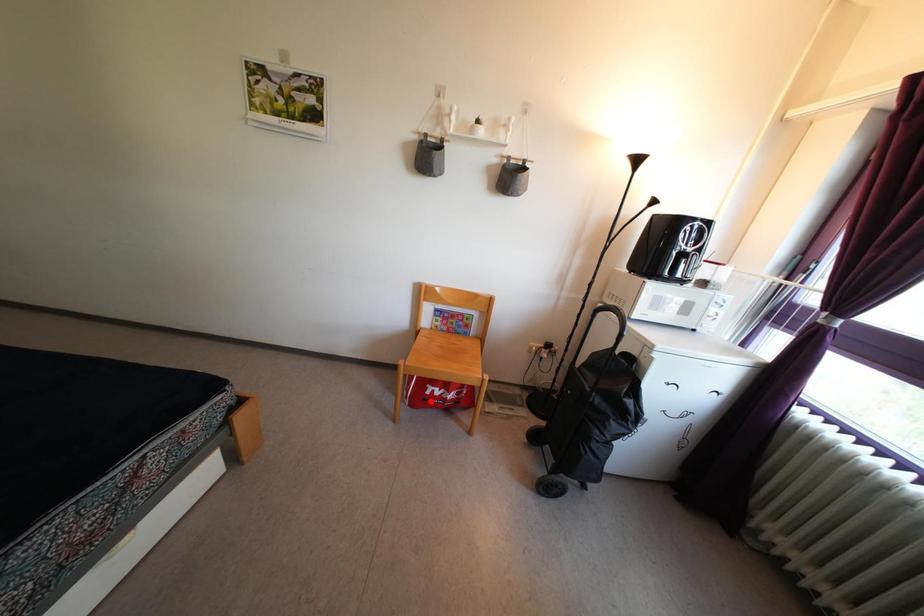
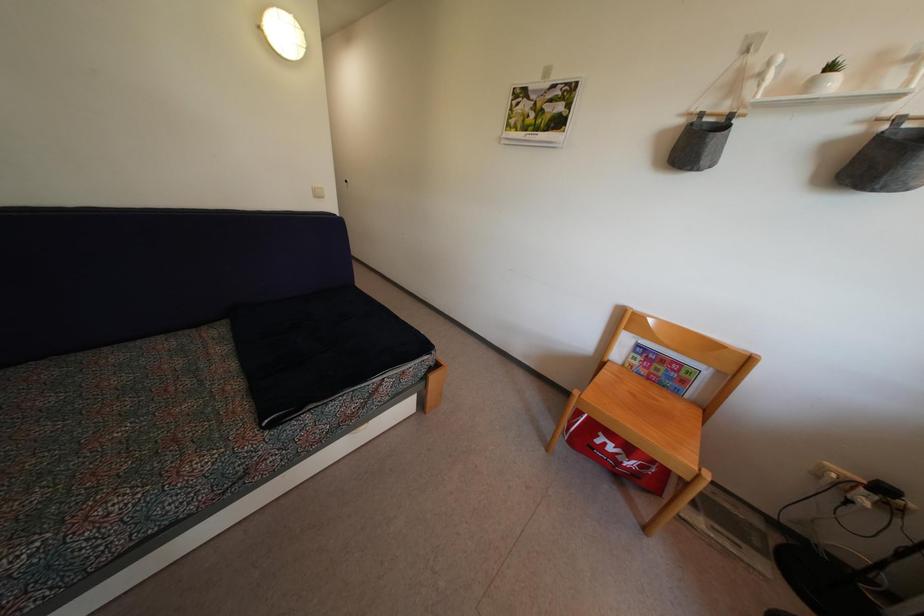
In the second image, find the point that corresponds to the highlighted location in the first image.

(601, 450)